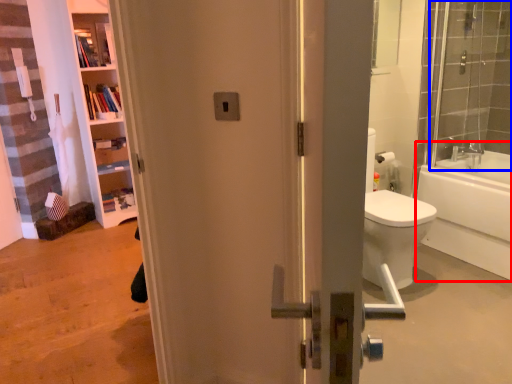
Question: Which of the following is the closest to the observer, bathtub (highlighted by a red box) or shower door (highlighted by a blue box)?

Choices:
 (A) bathtub
 (B) shower door

Answer: (B)